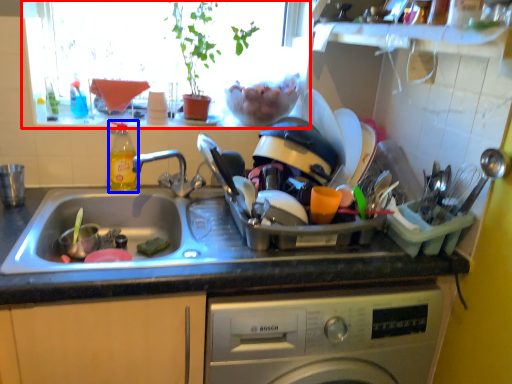
Question: Which point is further to the camera, window screen (highlighted by a red box) or bottle (highlighted by a blue box)?

Choices:
 (A) window screen
 (B) bottle

Answer: (B)